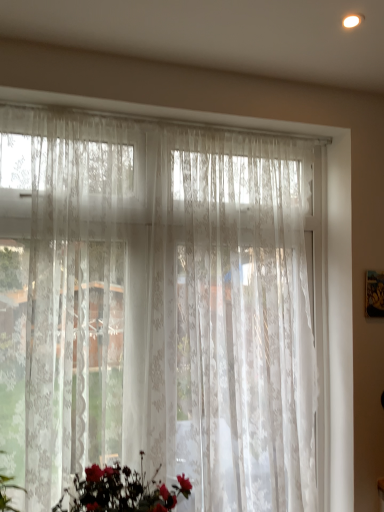
Question: From the image's perspective, is silky white bouquet at lower center beneath translucent floral-patterned curtain at center?

Choices:
 (A) no
 (B) yes

Answer: (B)

Question: Considering the relative sizes of silky white bouquet at lower center and translucent floral-patterned curtain at center in the image provided, is silky white bouquet at lower center smaller than translucent floral-patterned curtain at center?

Choices:
 (A) no
 (B) yes

Answer: (B)

Question: Can you confirm if silky white bouquet at lower center is bigger than translucent floral-patterned curtain at center?

Choices:
 (A) yes
 (B) no

Answer: (B)

Question: Is silky white bouquet at lower center completely or partially outside of translucent floral-patterned curtain at center?

Choices:
 (A) no
 (B) yes

Answer: (B)

Question: Can you confirm if silky white bouquet at lower center is thinner than translucent floral-patterned curtain at center?

Choices:
 (A) no
 (B) yes

Answer: (A)

Question: Does silky white bouquet at lower center turn towards translucent floral-patterned curtain at center?

Choices:
 (A) yes
 (B) no

Answer: (B)

Question: Is translucent floral-patterned curtain at center thinner than silky white bouquet at lower center?

Choices:
 (A) no
 (B) yes

Answer: (B)

Question: Does translucent floral-patterned curtain at center have a larger size compared to silky white bouquet at lower center?

Choices:
 (A) yes
 (B) no

Answer: (A)

Question: Considering the relative sizes of translucent floral-patterned curtain at center and silky white bouquet at lower center in the image provided, is translucent floral-patterned curtain at center shorter than silky white bouquet at lower center?

Choices:
 (A) no
 (B) yes

Answer: (A)

Question: From the image's perspective, does translucent floral-patterned curtain at center appear higher than silky white bouquet at lower center?

Choices:
 (A) yes
 (B) no

Answer: (A)

Question: Is translucent floral-patterned curtain at center smaller than silky white bouquet at lower center?

Choices:
 (A) no
 (B) yes

Answer: (A)

Question: Are translucent floral-patterned curtain at center and silky white bouquet at lower center making contact?

Choices:
 (A) yes
 (B) no

Answer: (B)

Question: Do you think translucent floral-patterned curtain at center is within silky white bouquet at lower center, or outside of it?

Choices:
 (A) inside
 (B) outside

Answer: (B)